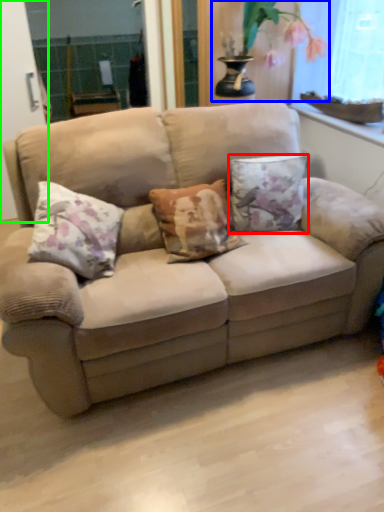
Question: Which object is the closest to the pillow (highlighted by a red box)? Choose among these: floral arrangement (highlighted by a blue box) or screen door (highlighted by a green box).

Choices:
 (A) floral arrangement
 (B) screen door

Answer: (A)